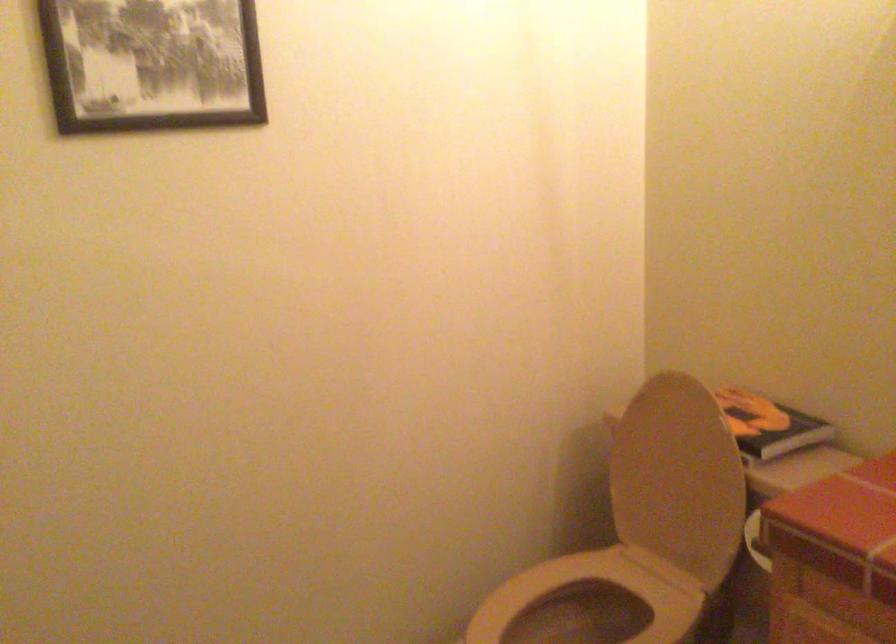
Question: How did the camera likely rotate?

Choices:
 (A) Left
 (B) Right
 (C) Up
 (D) Down

Answer: (B)